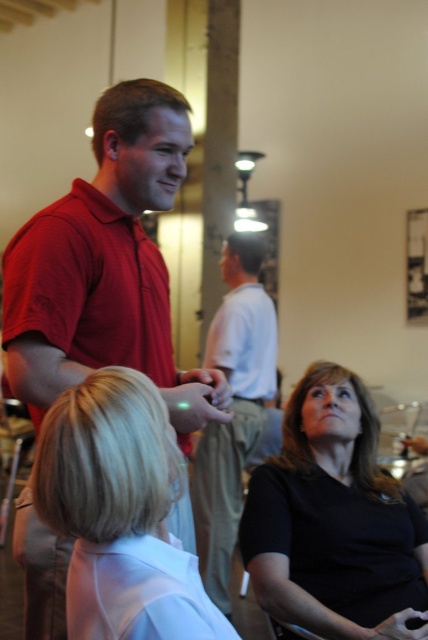
You are standing in the room and want to determine which of the two points, point (x=418, y=595) or point (x=62, y=424), is closer to you. Based on the scene, which point is nearer?

Point (x=62, y=424) is closer to you because it is positioned closer to the camera than point (x=418, y=595), which is further away.

You are a photographer trying to capture a candid shot of the two people at the center of the scene. The camera you are using has a focus area that can only accommodate objects up to the width of the light gray cotton shirt at center. Will the blonde hair at center fit within this focus area?

The blonde hair at center has a lesser width compared to the light gray cotton shirt at center, so it will fit within the focus area.